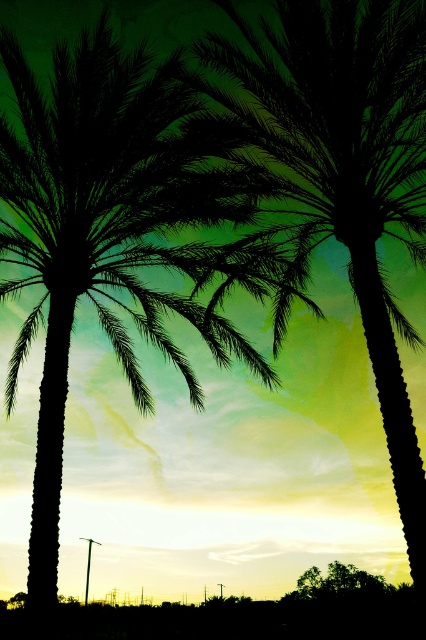
Question: Is the position of black silhouette palm tree at center more distant than that of silhouette palm tree at center?

Choices:
 (A) no
 (B) yes

Answer: (B)

Question: Which point appears farthest from the camera in this image?

Choices:
 (A) (386, 45)
 (B) (298, 592)

Answer: (B)

Question: Which of these objects is positioned farthest from the black silhouette palm tree at center?

Choices:
 (A) silhouette leafy tree at lower center
 (B) silhouette palm tree at center

Answer: (A)

Question: Is silhouette palm tree at center above silhouette leafy tree at lower center?

Choices:
 (A) no
 (B) yes

Answer: (B)

Question: Which point is closer to the camera taking this photo?

Choices:
 (A) (60, 122)
 (B) (322, 586)

Answer: (A)

Question: Is black silhouette palm tree at center below silhouette leafy tree at lower center?

Choices:
 (A) no
 (B) yes

Answer: (A)